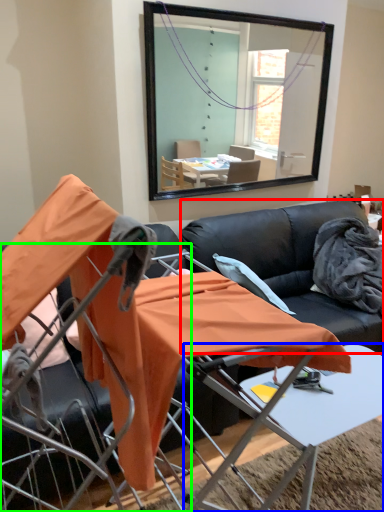
Question: Considering the real-world distances, which object is farthest from couch (highlighted by a red box)? table (highlighted by a blue box) or chair (highlighted by a green box)?

Choices:
 (A) table
 (B) chair

Answer: (B)